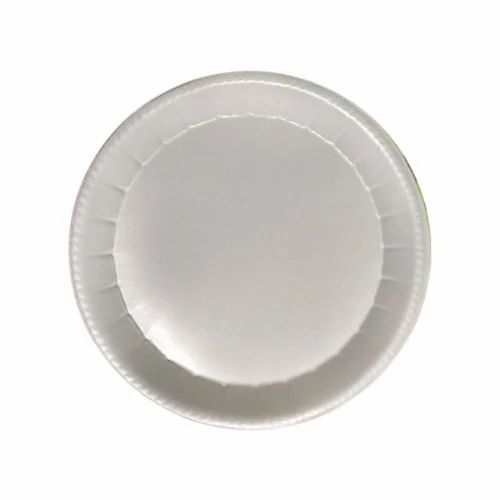
Locate an element on the screen. decorative edge on plate is located at coordinates (338, 101).